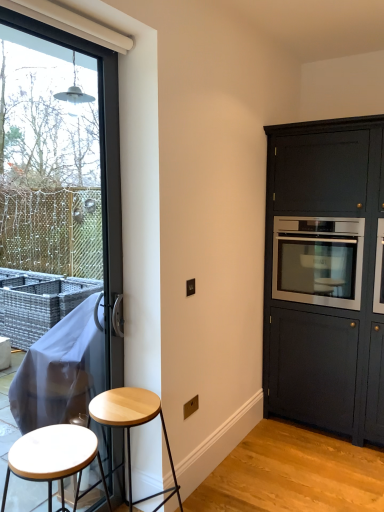
The width and height of the screenshot is (384, 512). What do you see at coordinates (54, 458) in the screenshot? I see `white matte stool at lower left, arranged as the 2th stool when viewed from the back` at bounding box center [54, 458].

In order to face stainless steel oven at right, should I rotate leftwards or rightwards?

You should rotate right by 17.542 degrees.

The image size is (384, 512). Describe the element at coordinates (102, 157) in the screenshot. I see `transparent glass window at left` at that location.

In order to face matte dark wood cabinet at right, should I rotate leftwards or rightwards?

It's best to rotate right around 18.782 degrees.

The width and height of the screenshot is (384, 512). What do you see at coordinates (325, 276) in the screenshot?
I see `matte dark wood cabinet at right` at bounding box center [325, 276].

Measure the distance between light wood stool at lower left, which is counted as the 2th stool, starting from the front, and camera.

The distance of light wood stool at lower left, which is counted as the 2th stool, starting from the front, from camera is 1.79 meters.

At what (x,y) coordinates should I click in order to perform the action: click on light wood stool at lower left, which is counted as the 2th stool, starting from the front. Please return your answer as a coordinate pair (x, y). This screenshot has height=512, width=384. Looking at the image, I should click on click(132, 425).

Where is `white matte stool at lower left, which appears as the first stool when viewed from the front`? white matte stool at lower left, which appears as the first stool when viewed from the front is located at coordinates (54, 458).

Is the position of transparent glass window at left less distant than that of matte dark wood cabinet at right?

Yes, it is.

In order to click on cabinetry below the transparent glass window at left (from a real-world perspective) in this screenshot , I will do pyautogui.click(x=325, y=276).

Consider the image. Who is bigger, transparent glass window at left or matte dark wood cabinet at right?

Bigger between the two is matte dark wood cabinet at right.

From the image's perspective, is transparent glass window at left above matte dark wood cabinet at right?

Actually, transparent glass window at left appears below matte dark wood cabinet at right in the image.

Measure the distance from light wood stool at lower left, the first stool in the back-to-front sequence, to white matte stool at lower left, arranged as the 2th stool when viewed from the back.

light wood stool at lower left, the first stool in the back-to-front sequence, is 14.43 inches from white matte stool at lower left, arranged as the 2th stool when viewed from the back.

Does light wood stool at lower left, the first stool in the back-to-front sequence, touch white matte stool at lower left, arranged as the 2th stool when viewed from the back?

No, light wood stool at lower left, the first stool in the back-to-front sequence, is not next to white matte stool at lower left, arranged as the 2th stool when viewed from the back.

Between light wood stool at lower left, the first stool in the back-to-front sequence, and white matte stool at lower left, arranged as the 2th stool when viewed from the back, which one is positioned behind?

light wood stool at lower left, the first stool in the back-to-front sequence.

Who is bigger, light wood stool at lower left, which is counted as the 2th stool, starting from the front, or white matte stool at lower left, which appears as the first stool when viewed from the front?

Bigger between the two is light wood stool at lower left, which is counted as the 2th stool, starting from the front.

From a real-world perspective, who is located higher, matte dark wood cabinet at right or light wood stool at lower left, the first stool in the back-to-front sequence?

matte dark wood cabinet at right is physically above.

Do you think matte dark wood cabinet at right is within light wood stool at lower left, the first stool in the back-to-front sequence, or outside of it?

The correct answer is: outside.

Is matte dark wood cabinet at right oriented towards light wood stool at lower left, which is counted as the 2th stool, starting from the front?

Yes, matte dark wood cabinet at right is turned towards light wood stool at lower left, which is counted as the 2th stool, starting from the front.

Based on their sizes in the image, would you say matte dark wood cabinet at right is bigger or smaller than light wood stool at lower left, the first stool in the back-to-front sequence?

Considering their sizes, matte dark wood cabinet at right takes up more space than light wood stool at lower left, the first stool in the back-to-front sequence.

Visually, is white matte stool at lower left, arranged as the 2th stool when viewed from the back, positioned to the left or to the right of light wood stool at lower left, the first stool in the back-to-front sequence?

In the image, white matte stool at lower left, arranged as the 2th stool when viewed from the back, appears on the left side of light wood stool at lower left, the first stool in the back-to-front sequence.

This screenshot has width=384, height=512. I want to click on stool located on the left of light wood stool at lower left, which is counted as the 2th stool, starting from the front, so click(54, 458).

In the scene shown: From the image's perspective, is white matte stool at lower left, which appears as the first stool when viewed from the front, located beneath light wood stool at lower left, the first stool in the back-to-front sequence?

Incorrect, from the image's perspective, white matte stool at lower left, which appears as the first stool when viewed from the front, is higher than light wood stool at lower left, the first stool in the back-to-front sequence.

From a real-world perspective, is white matte stool at lower left, arranged as the 2th stool when viewed from the back, above or below light wood stool at lower left, which is counted as the 2th stool, starting from the front?

white matte stool at lower left, arranged as the 2th stool when viewed from the back, is situated higher than light wood stool at lower left, which is counted as the 2th stool, starting from the front, in the real world.

Is light wood stool at lower left, which is counted as the 2th stool, starting from the front, positioned with its back to stainless steel oven at right?

No, light wood stool at lower left, which is counted as the 2th stool, starting from the front, is not facing the opposite direction of stainless steel oven at right.

In the image, is light wood stool at lower left, which is counted as the 2th stool, starting from the front, on the left side or the right side of stainless steel oven at right?

From the image, it's evident that light wood stool at lower left, which is counted as the 2th stool, starting from the front, is to the left of stainless steel oven at right.

From a real-world perspective, which object stands above the other?

In real-world perspective, stainless steel oven at right is above.

Considering the sizes of light wood stool at lower left, which is counted as the 2th stool, starting from the front, and stainless steel oven at right in the image, is light wood stool at lower left, which is counted as the 2th stool, starting from the front, taller or shorter than stainless steel oven at right?

Clearly, light wood stool at lower left, which is counted as the 2th stool, starting from the front, is taller compared to stainless steel oven at right.

From a real-world perspective, which is physically below, matte dark wood cabinet at right or transparent glass window at left?

matte dark wood cabinet at right, from a real-world perspective.

Can you tell me how much matte dark wood cabinet at right and transparent glass window at left differ in facing direction?

90.6 degrees separate the facing orientations of matte dark wood cabinet at right and transparent glass window at left.

Considering the sizes of objects matte dark wood cabinet at right and transparent glass window at left in the image provided, who is bigger, matte dark wood cabinet at right or transparent glass window at left?

matte dark wood cabinet at right.

From the image's perspective, is matte dark wood cabinet at right located above transparent glass window at left?

Yes, from the image's perspective, matte dark wood cabinet at right is on top of transparent glass window at left.

Could you tell me if stainless steel oven at right is turned towards white matte stool at lower left, arranged as the 2th stool when viewed from the back?

Yes, stainless steel oven at right is aimed at white matte stool at lower left, arranged as the 2th stool when viewed from the back.

Considering the positions of objects stainless steel oven at right and white matte stool at lower left, arranged as the 2th stool when viewed from the back, in the image provided, who is in front, stainless steel oven at right or white matte stool at lower left, arranged as the 2th stool when viewed from the back,?

white matte stool at lower left, arranged as the 2th stool when viewed from the back, is in front.

What's the angular difference between stainless steel oven at right and white matte stool at lower left, which appears as the first stool when viewed from the front,'s facing directions?

The angular difference between stainless steel oven at right and white matte stool at lower left, which appears as the first stool when viewed from the front, is 89.3 degrees.

The height and width of the screenshot is (512, 384). What are the coordinates of `window above the matte dark wood cabinet at right (from a real-world perspective)` in the screenshot? It's located at (102, 157).

Where is `stool that appears behind the white matte stool at lower left, arranged as the 2th stool when viewed from the back`? stool that appears behind the white matte stool at lower left, arranged as the 2th stool when viewed from the back is located at coordinates (132, 425).

Considering their positions, is matte dark wood cabinet at right positioned closer to transparent glass window at left than white matte stool at lower left, which appears as the first stool when viewed from the front?

white matte stool at lower left, which appears as the first stool when viewed from the front, is positioned closer to the anchor transparent glass window at left.

Considering their positions, is light wood stool at lower left, which is counted as the 2th stool, starting from the front, positioned further to matte dark wood cabinet at right than stainless steel oven at right?

Based on the image, light wood stool at lower left, which is counted as the 2th stool, starting from the front, appears to be further to matte dark wood cabinet at right.

Considering their positions, is transparent glass window at left positioned further to white matte stool at lower left, which appears as the first stool when viewed from the front, than light wood stool at lower left, which is counted as the 2th stool, starting from the front?

The object further to white matte stool at lower left, which appears as the first stool when viewed from the front, is transparent glass window at left.

Considering their positions, is light wood stool at lower left, which is counted as the 2th stool, starting from the front, positioned further to white matte stool at lower left, arranged as the 2th stool when viewed from the back, than stainless steel oven at right?

stainless steel oven at right is positioned further to the anchor white matte stool at lower left, arranged as the 2th stool when viewed from the back.

Based on their spatial positions, is white matte stool at lower left, arranged as the 2th stool when viewed from the back, or light wood stool at lower left, which is counted as the 2th stool, starting from the front, further from transparent glass window at left?

white matte stool at lower left, arranged as the 2th stool when viewed from the back, lies further to transparent glass window at left than the other object.

From the image, which object appears to be farther from matte dark wood cabinet at right, transparent glass window at left or light wood stool at lower left, the first stool in the back-to-front sequence?

Among the two, transparent glass window at left is located further to matte dark wood cabinet at right.

Considering their positions, is white matte stool at lower left, arranged as the 2th stool when viewed from the back, positioned further to light wood stool at lower left, which is counted as the 2th stool, starting from the front, than transparent glass window at left?

transparent glass window at left.

From the image, which object appears to be nearer to white matte stool at lower left, which appears as the first stool when viewed from the front, stainless steel oven at right or light wood stool at lower left, the first stool in the back-to-front sequence?

Among the two, light wood stool at lower left, the first stool in the back-to-front sequence, is located nearer to white matte stool at lower left, which appears as the first stool when viewed from the front.

Identify the location of stool between transparent glass window at left and light wood stool at lower left, which is counted as the 2th stool, starting from the front, vertically. (54, 458).

Find the location of a particular element. The image size is (384, 512). stool between white matte stool at lower left, arranged as the 2th stool when viewed from the back, and matte dark wood cabinet at right is located at coordinates (132, 425).

Where is `oven between transparent glass window at left and matte dark wood cabinet at right in the horizontal direction`? oven between transparent glass window at left and matte dark wood cabinet at right in the horizontal direction is located at coordinates (318, 260).

Where is `stool between white matte stool at lower left, which appears as the first stool when viewed from the front, and stainless steel oven at right`? The image size is (384, 512). stool between white matte stool at lower left, which appears as the first stool when viewed from the front, and stainless steel oven at right is located at coordinates (132, 425).